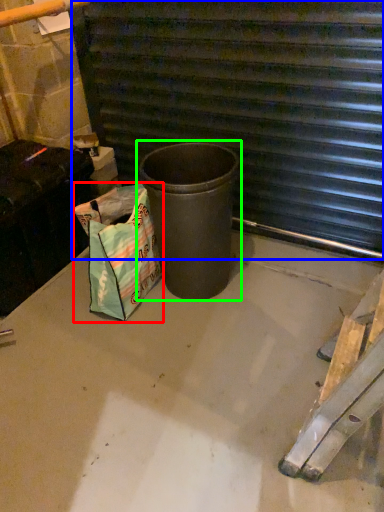
Question: Considering the real-world distances, which object is farthest from shopping bag (highlighted by a red box)? stairwell (highlighted by a blue box) or waste container (highlighted by a green box)?

Choices:
 (A) stairwell
 (B) waste container

Answer: (A)